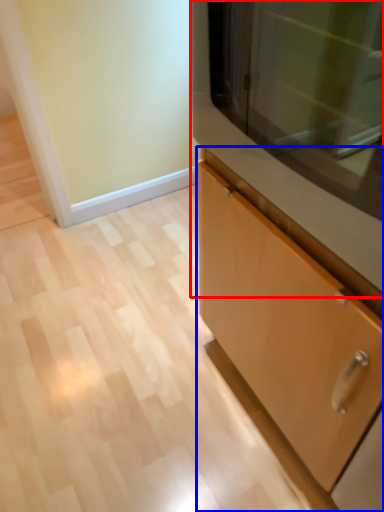
Question: Which object appears farthest to the camera in this image, microwave (highlighted by a red box) or cabinetry (highlighted by a blue box)?

Choices:
 (A) microwave
 (B) cabinetry

Answer: (A)